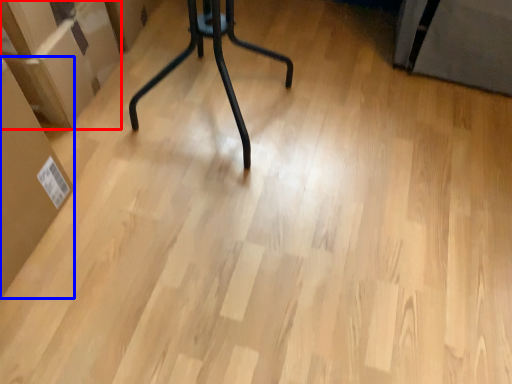
Question: Among these objects, which one is farthest to the camera, cardboard box (highlighted by a red box) or cardboard box (highlighted by a blue box)?

Choices:
 (A) cardboard box
 (B) cardboard box

Answer: (A)